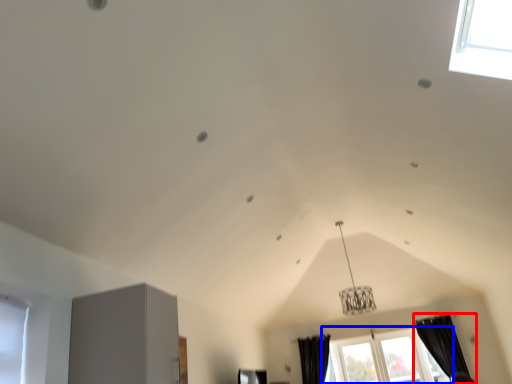
Question: Which object is further to the camera taking this photo, curtain (highlighted by a red box) or window (highlighted by a blue box)?

Choices:
 (A) curtain
 (B) window

Answer: (B)